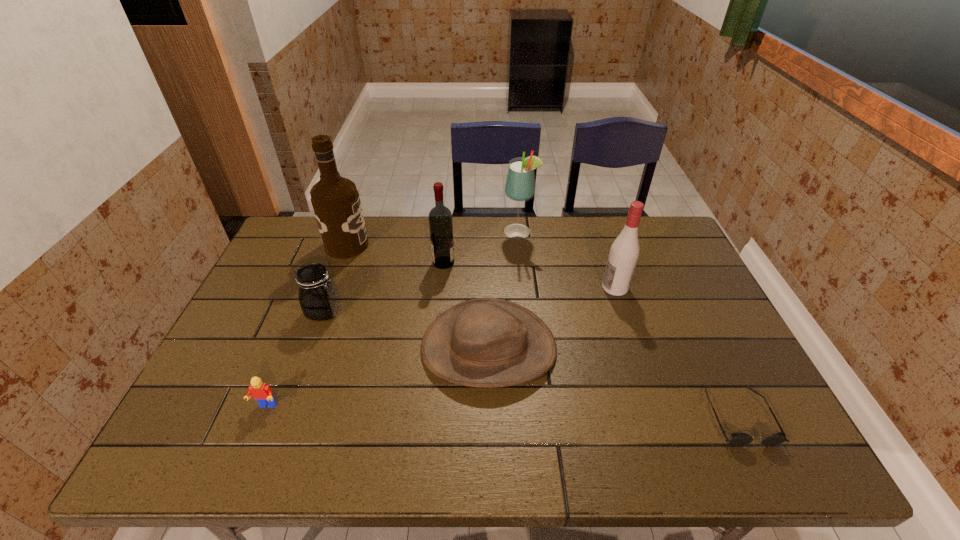
Where is `object that is the third closest to the leftmost alcohol`? object that is the third closest to the leftmost alcohol is located at coordinates (488, 342).

Identify which object is the third closest to the Lego. Please provide its 2D coordinates. Your answer should be formatted as a tuple, i.e. [(x, y)], where the tuple contains the x and y coordinates of a point satisfying the conditions above.

[(335, 200)]

This screenshot has width=960, height=540. What are the coordinates of `alcohol identified as the closest to the leftmost alcohol` in the screenshot? It's located at (440, 218).

You are a GUI agent. You are given a task and a screenshot of the screen. Output one action in this format:
    pyautogui.click(x=<x>, y=<y>)
    Task: Click on the third closest alcohol to the second alcohol from right to left
    
    Given the screenshot: What is the action you would take?
    pyautogui.click(x=335, y=200)

The image size is (960, 540). I want to click on vacant area that satisfies the following two spatial constraints: 1. on the lid of the fifth tallest object; 2. on the left side of the cowboy hat, so click(311, 348).

Image resolution: width=960 pixels, height=540 pixels. Find the location of `free space that satisfies the following two spatial constraints: 1. on the label of the rightmost alcohol; 2. on the front-facing side of the Lego`. free space that satisfies the following two spatial constraints: 1. on the label of the rightmost alcohol; 2. on the front-facing side of the Lego is located at coordinates (654, 406).

At what (x,y) coordinates should I click in order to perform the action: click on free spot that satisfies the following two spatial constraints: 1. on the front and back of the third alcohol from right to left; 2. on the front-facing side of the Lego. Please return your answer as a coordinate pair (x, y). This screenshot has width=960, height=540. Looking at the image, I should click on (430, 406).

In order to click on free space that satisfies the following two spatial constraints: 1. on the lid of the jar; 2. on the left side of the cowboy hat in this screenshot , I will do `click(311, 348)`.